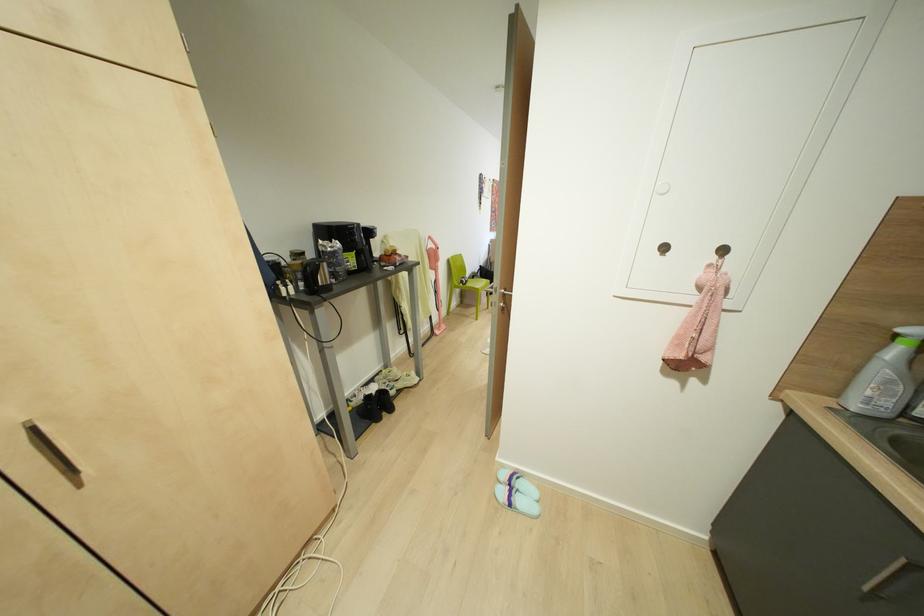
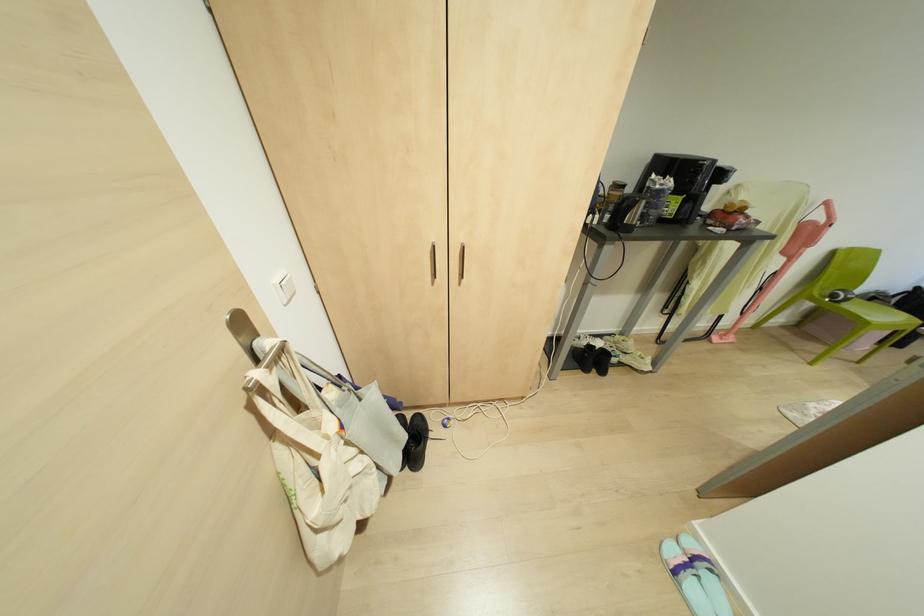
In the second image, find the point that corresponds to (x=336, y=244) in the first image.

(670, 182)